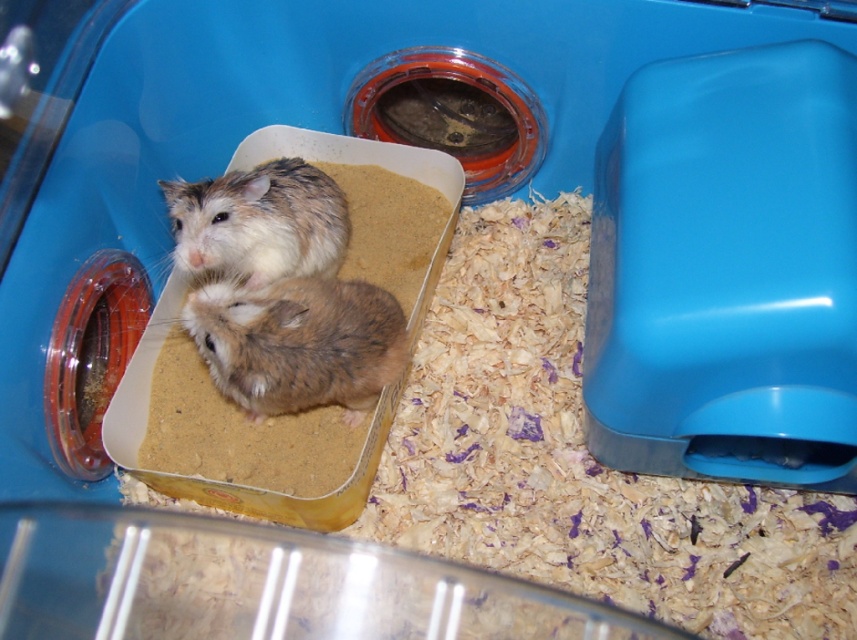
Is fuzzy brown mouse at center closer to camera compared to fuzzy brown hamster at center?

That is True.

Who is more distant from viewer, (219, 362) or (246, 273)?

The point (246, 273) is more distant.

Identify the location of fuzzy brown mouse at center. (298, 342).